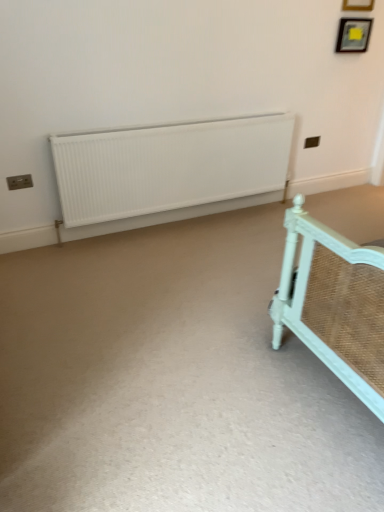
Question: From the image's perspective, relative to wooden picture frame at upper right, the first picture frame when ordered from top to bottom, is wooden picture frame at upper right, which is the 1th picture frame in bottom-to-top order, above or below?

Choices:
 (A) above
 (B) below

Answer: (B)

Question: Looking at their shapes, would you say wooden picture frame at upper right, acting as the 2th picture frame starting from the top, is wider or thinner than wooden picture frame at upper right, the second picture frame in the bottom-to-top sequence?

Choices:
 (A) thin
 (B) wide

Answer: (B)

Question: Estimate the real-world distances between objects in this image. Which object is farther from the wooden picture frame at upper right, acting as the 2th picture frame starting from the top?

Choices:
 (A) wooden picture frame at upper right, the first picture frame when ordered from top to bottom
 (B) white matte radiator at center

Answer: (B)

Question: Estimate the real-world distances between objects in this image. Which object is farther from the white matte radiator at center?

Choices:
 (A) wooden picture frame at upper right, acting as the 2th picture frame starting from the top
 (B) wooden picture frame at upper right, the first picture frame when ordered from top to bottom

Answer: (B)